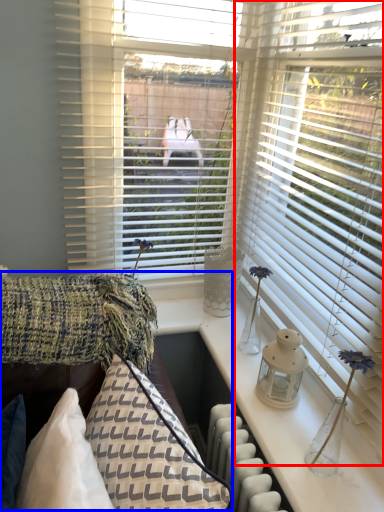
Question: Which object is closer to the camera taking this photo, window blind (highlighted by a red box) or couch (highlighted by a blue box)?

Choices:
 (A) window blind
 (B) couch

Answer: (B)